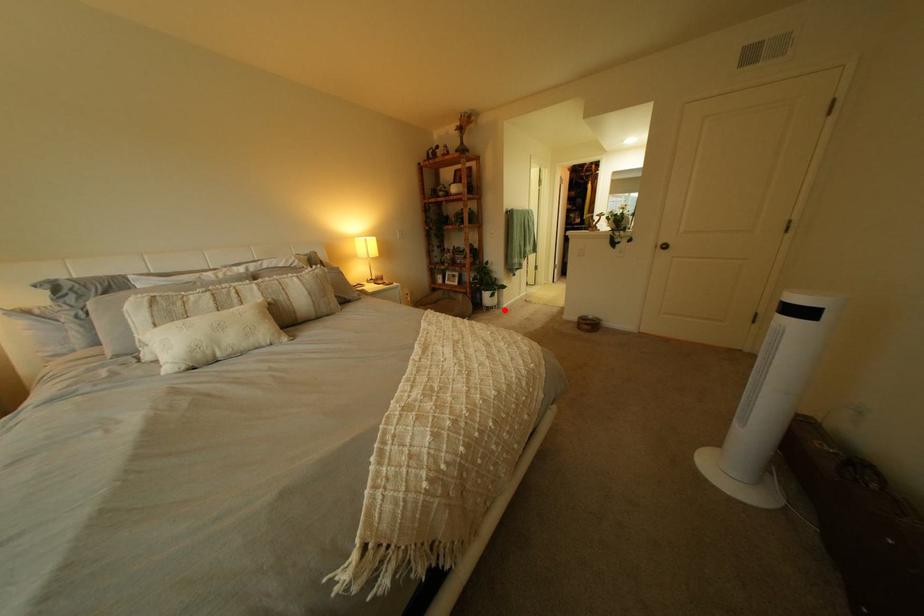
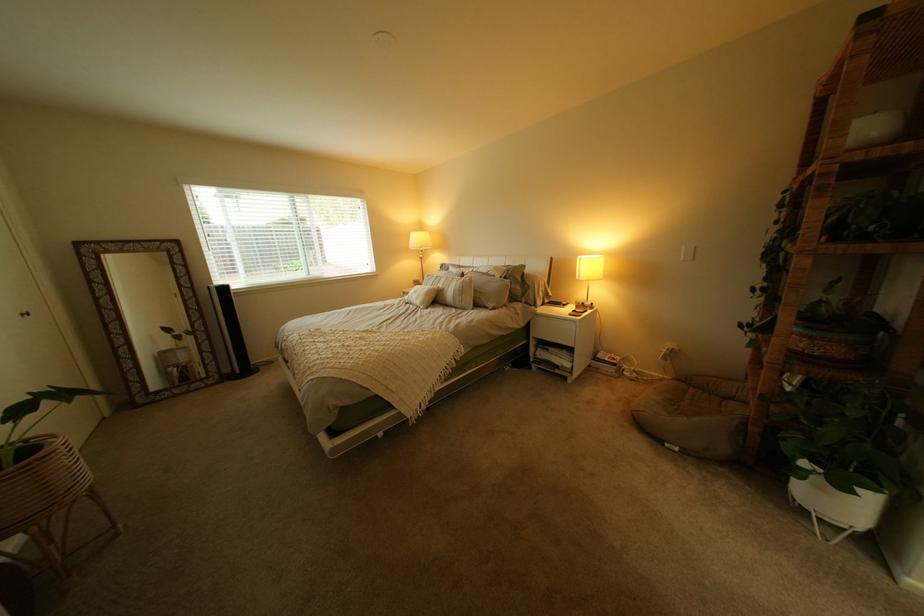
Question: I am providing you with two images of the same scene from different viewpoints. In image1, a red point is highlighted. Considering the same 3D point in image2, which of the following is correct?

Choices:
 (A) It is closer
 (B) It is farther

Answer: (B)